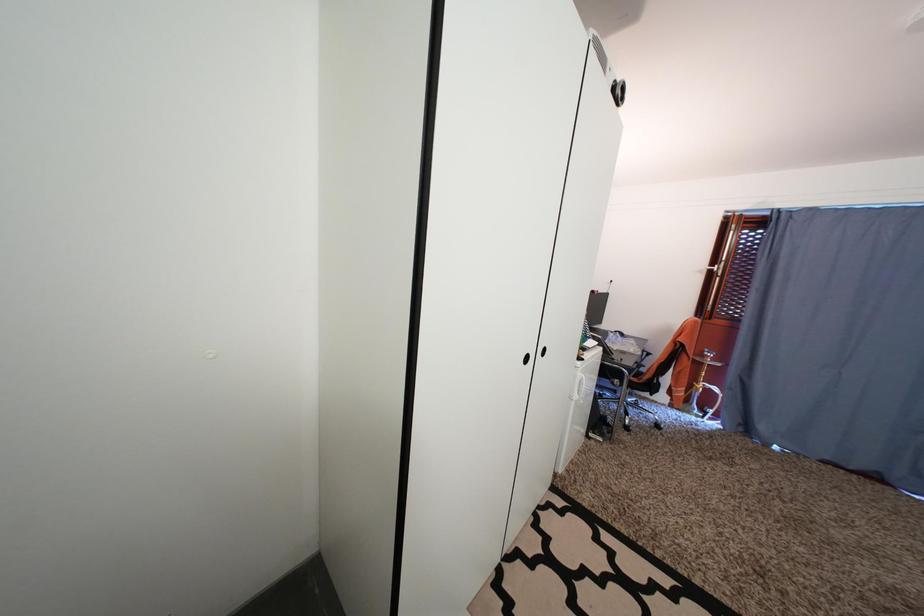
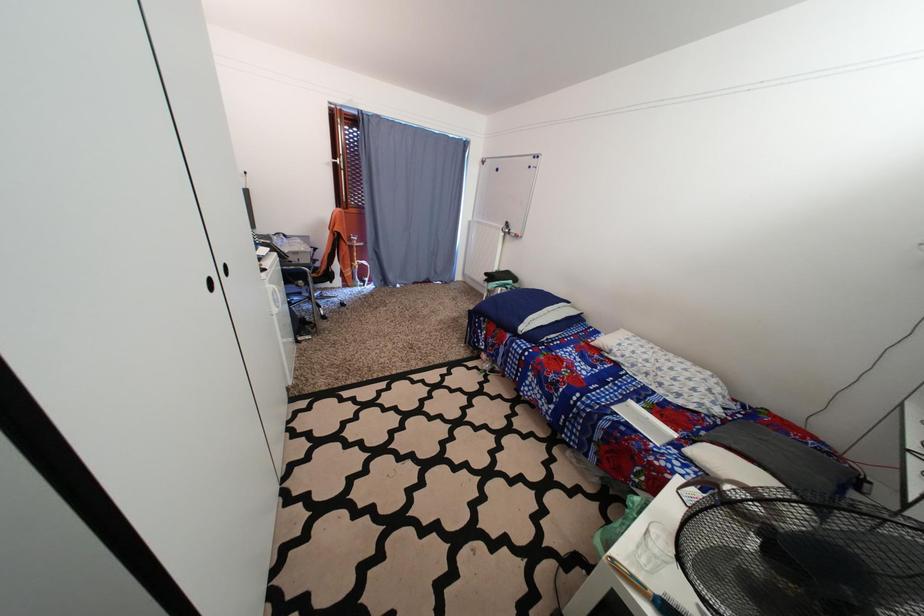
The images are taken continuously from a first-person perspective. In which direction is your viewpoint rotating?

The camera rotated toward right-down.